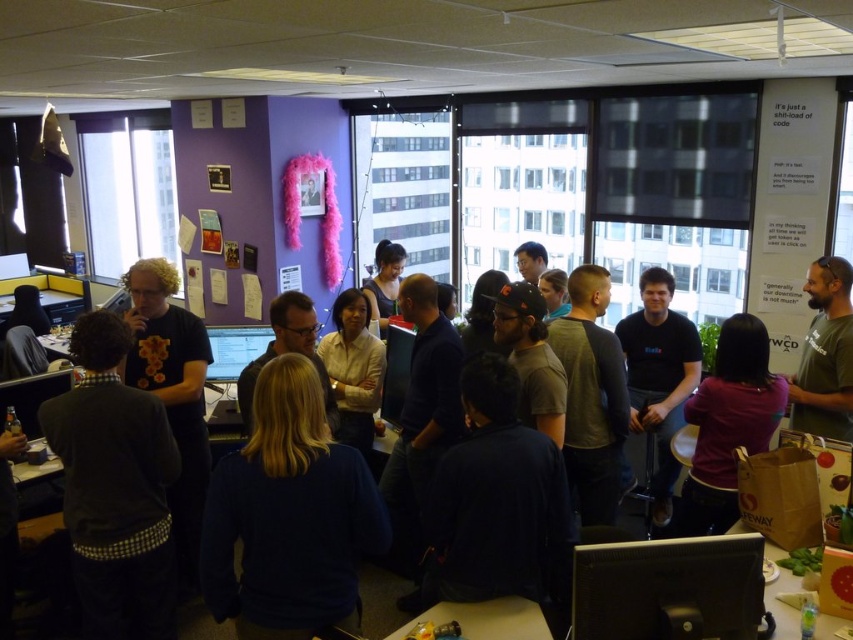
Does dark gray sweater at lower left appear over black glossy monitor at lower right?

Yes.

Does dark gray sweater at lower left lie in front of black glossy monitor at lower right?

No.

Is point (73, 458) positioned in front of point (698, 621)?

No, it is behind (698, 621).

Where is `dark gray sweater at lower left`? The width and height of the screenshot is (853, 640). dark gray sweater at lower left is located at coordinates (115, 488).

Is dark gray sweater at lower left above matte black monitor at center?

No, dark gray sweater at lower left is not above matte black monitor at center.

Is point (84, 508) less distant than point (221, 340)?

Yes, it is in front of point (221, 340).

Where is `dark gray sweater at lower left`? This screenshot has width=853, height=640. dark gray sweater at lower left is located at coordinates (115, 488).

Is black glossy monitor at lower right smaller than black matte shirt at center?

Yes, black glossy monitor at lower right is smaller than black matte shirt at center.

Measure the distance between point (668, 579) and camera.

Point (668, 579) is 1.89 meters from camera.

Image resolution: width=853 pixels, height=640 pixels. I want to click on black glossy monitor at lower right, so click(668, 588).